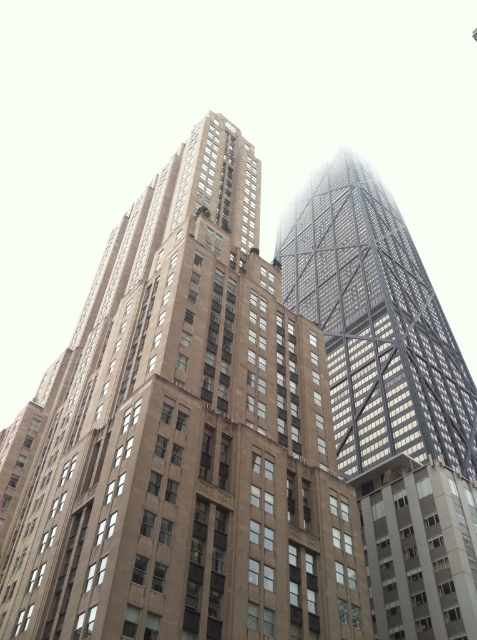
Measure the distance between point (176, 384) and camera.

Point (176, 384) and camera are 46.87 meters apart.

Can you confirm if brown stone building at center is wider than metallic glass tower at upper right?

No.

Who is more forward, (242, 616) or (338, 465)?

Point (242, 616)

Locate an element on the screen. The height and width of the screenshot is (640, 477). brown stone building at center is located at coordinates (183, 438).